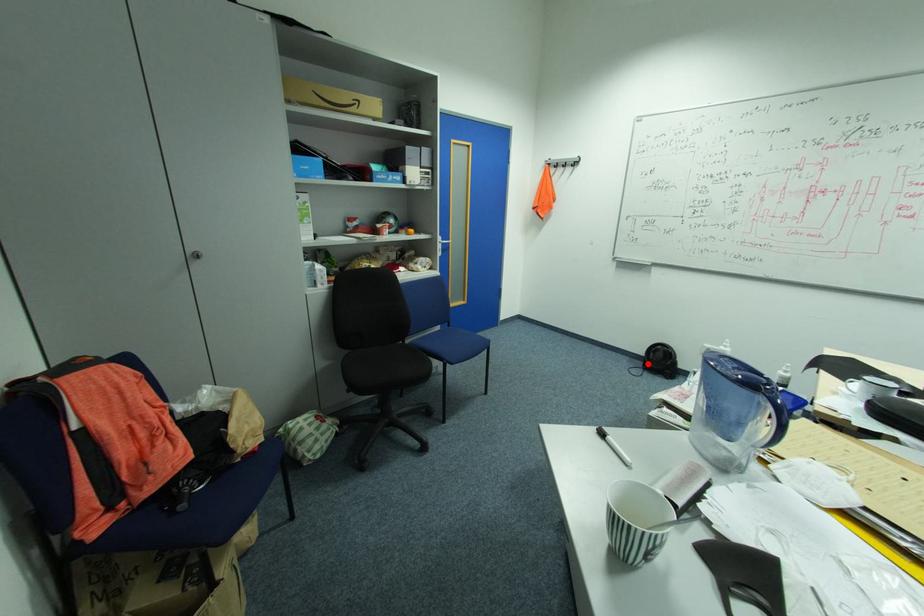
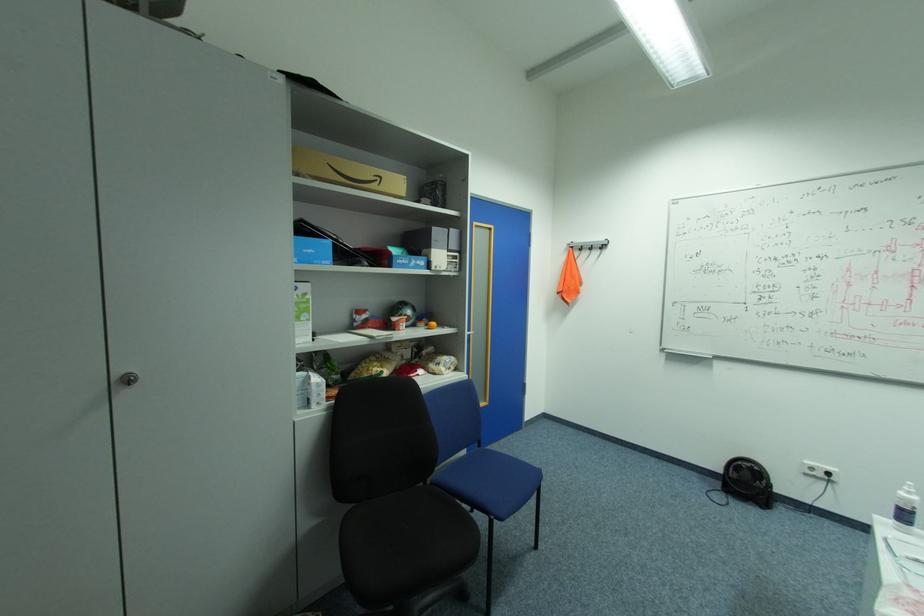
Question: I am providing you with two images of the same scene from different viewpoints. In image1, a red point is highlighted. Considering the same 3D point in image2, which of the following is correct?

Choices:
 (A) It is closer
 (B) It is farther

Answer: (B)